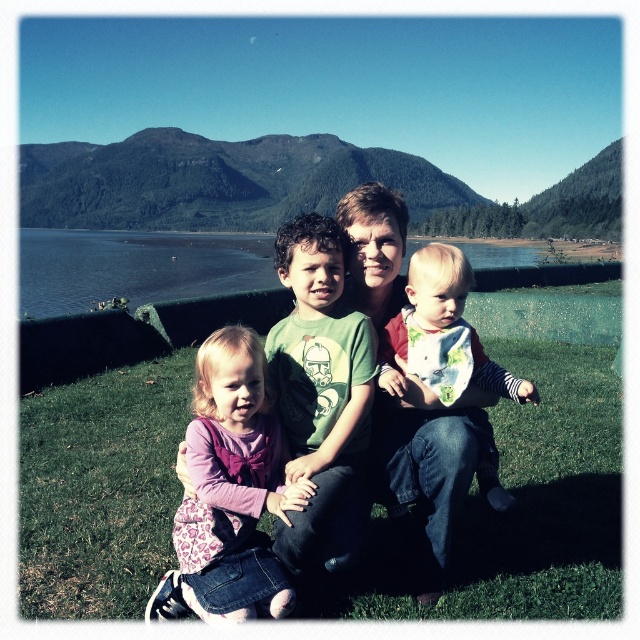
At what (x,y) coordinates should I click in order to perform the action: click on green matte shirt at center. Please return your answer as a coordinate pair (x, y). This screenshot has width=640, height=640. Looking at the image, I should click on (321, 396).

Does point (314, 493) come farther from viewer compared to point (380, 380)?

No, it is in front of (380, 380).

Is point (321, 289) positioned after point (400, 396)?

Yes.

This screenshot has width=640, height=640. In order to click on green matte shirt at center in this screenshot , I will do `click(321, 396)`.

Is pink fabric dress at center bigger than green cotton shirt at center?

Actually, pink fabric dress at center might be smaller than green cotton shirt at center.

Can you confirm if pink fabric dress at center is positioned to the left of green cotton shirt at center?

Correct, you'll find pink fabric dress at center to the left of green cotton shirt at center.

What do you see at coordinates (228, 492) in the screenshot? I see `pink fabric dress at center` at bounding box center [228, 492].

The image size is (640, 640). In order to click on pink fabric dress at center in this screenshot , I will do `click(228, 492)`.

Who is more distant from viewer, (x=410, y=417) or (x=413, y=266)?

Point (x=410, y=417)

Can you confirm if green cotton shirt at center is thinner than white cotton shirt at center?

Incorrect, green cotton shirt at center's width is not less than white cotton shirt at center's.

Is point (440, 442) less distant than point (426, 340)?

Yes, it is.

Locate an element on the screen. green cotton shirt at center is located at coordinates (428, 467).